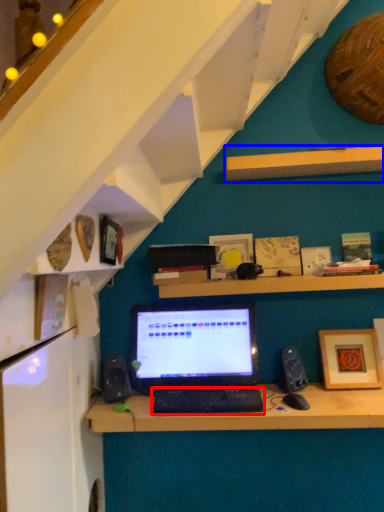
Question: Which of the following is the closest to the observer, computer keyboard (highlighted by a red box) or shelf (highlighted by a blue box)?

Choices:
 (A) computer keyboard
 (B) shelf

Answer: (A)